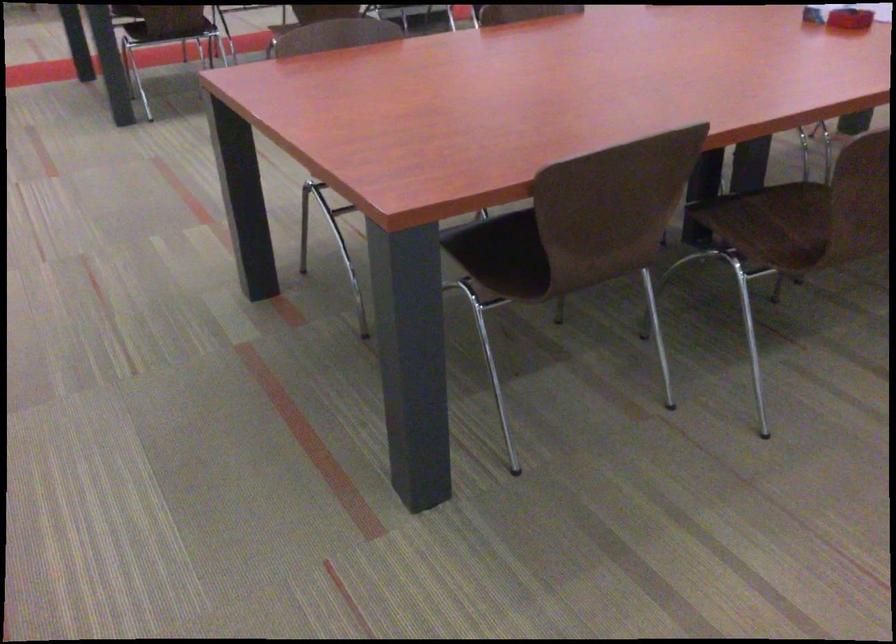
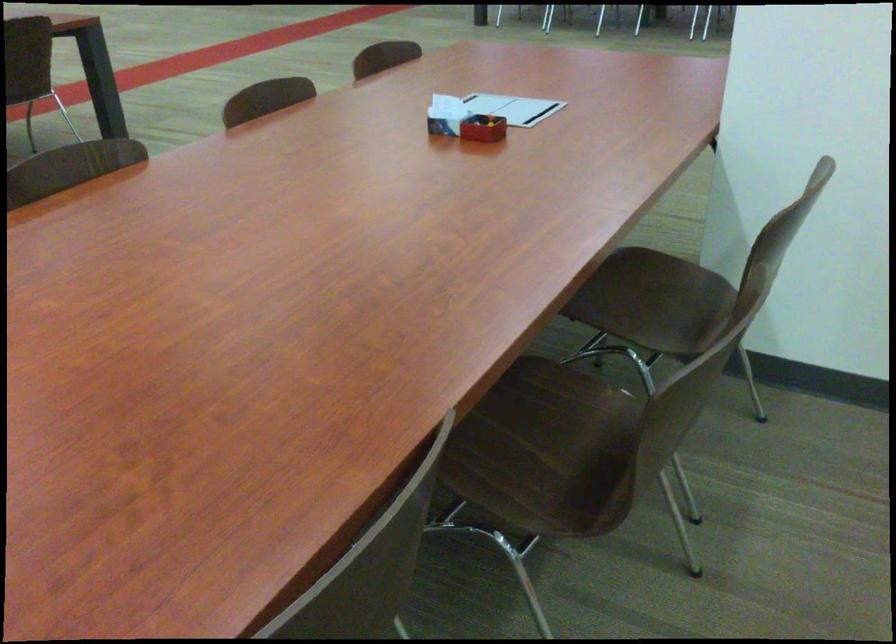
Question: How did the camera likely rotate?

Choices:
 (A) Left
 (B) Right
 (C) Up
 (D) Down

Answer: (B)